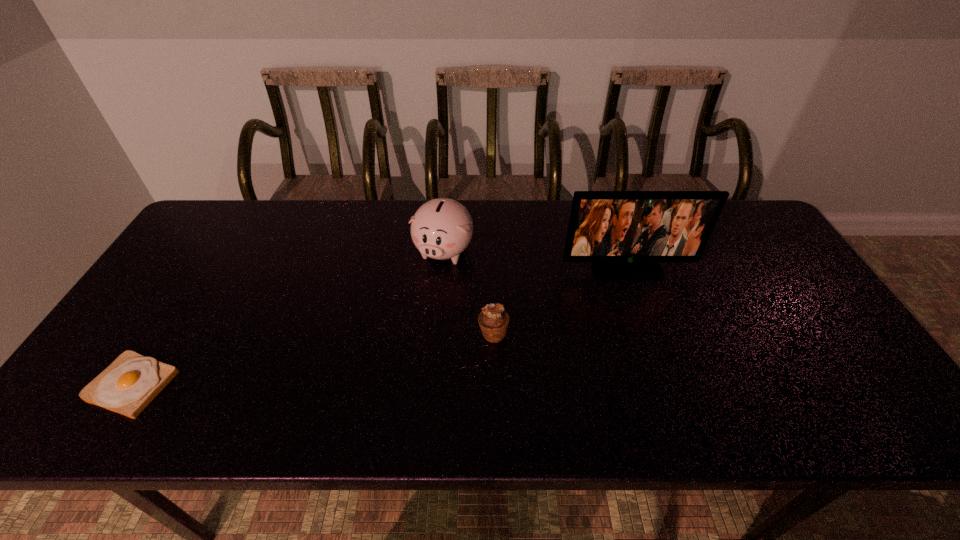
You are a GUI agent. You are given a task and a screenshot of the screen. Output one action in this format:
    pyautogui.click(x=<x>, y=<y>)
    Task: Click on the free area in between the third farthest object and the tallest object
    The image size is (960, 540).
    Given the screenshot: What is the action you would take?
    pyautogui.click(x=560, y=302)

The height and width of the screenshot is (540, 960). I want to click on vacant point located between the leftmost object and the muffin, so click(x=313, y=360).

At what (x,y) coordinates should I click in order to perform the action: click on free space between the shortest object and the second object from right to left. Please return your answer as a coordinate pair (x, y). The image size is (960, 540). Looking at the image, I should click on (313, 360).

Where is `vacant space that is in between the nearest object and the tallest object`? Image resolution: width=960 pixels, height=540 pixels. vacant space that is in between the nearest object and the tallest object is located at coordinates (380, 328).

This screenshot has width=960, height=540. Find the location of `vacant point located between the nearest object and the piggy bank`. vacant point located between the nearest object and the piggy bank is located at coordinates (288, 318).

At what (x,y) coordinates should I click in order to perform the action: click on free area in between the toast and the piggy bank. Please return your answer as a coordinate pair (x, y). This screenshot has height=540, width=960. Looking at the image, I should click on (288, 318).

Where is `empty location between the third farthest object and the toast`? The image size is (960, 540). empty location between the third farthest object and the toast is located at coordinates (313, 360).

The width and height of the screenshot is (960, 540). In order to click on vacant space that is in between the third tallest object and the second tallest object in this screenshot , I will do `click(468, 293)`.

You are a GUI agent. You are given a task and a screenshot of the screen. Output one action in this format:
    pyautogui.click(x=<x>, y=<y>)
    Task: Click on the free point between the second shortest object and the piggy bank
    The image size is (960, 540).
    Given the screenshot: What is the action you would take?
    pyautogui.click(x=468, y=293)

The height and width of the screenshot is (540, 960). In order to click on vacant space in between the toast and the second nearest object in this screenshot , I will do `click(313, 360)`.